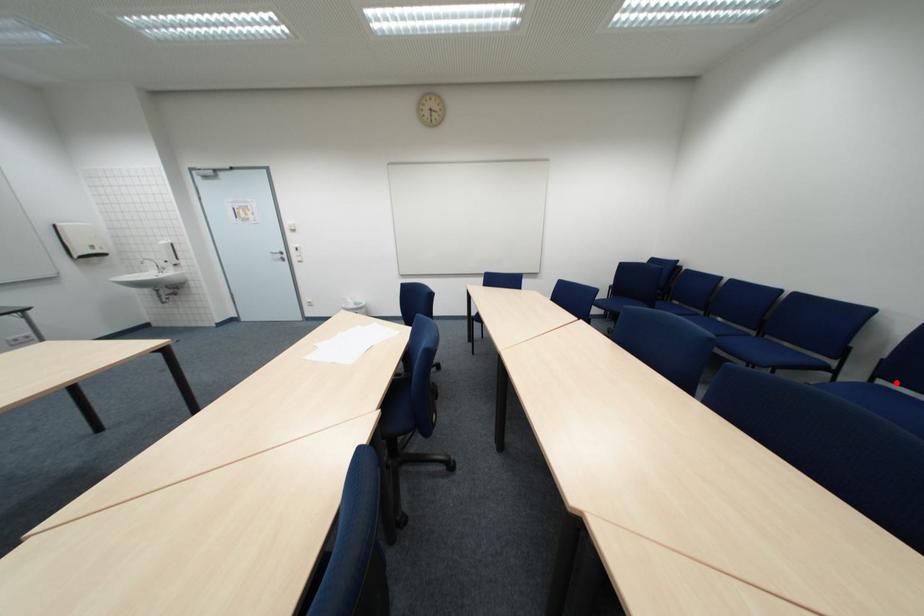
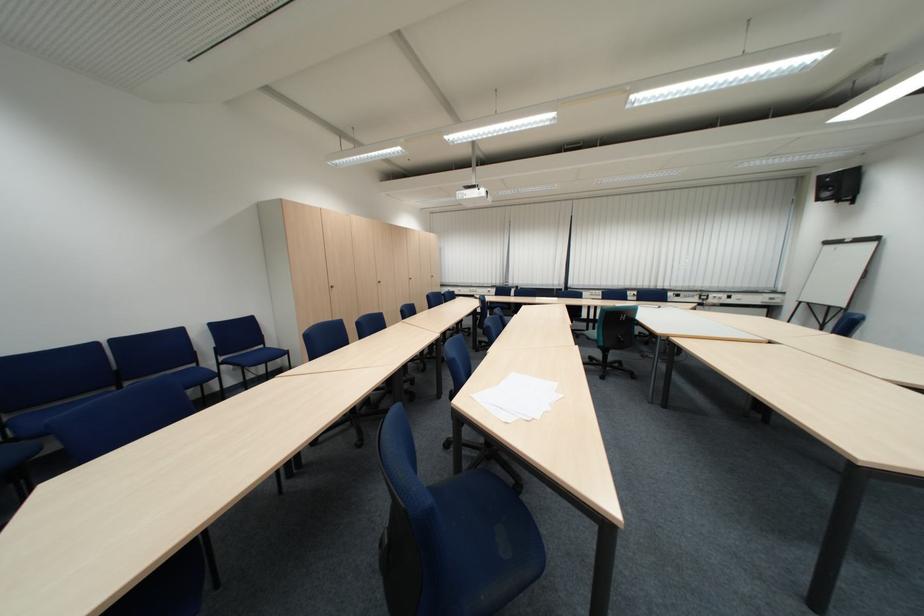
The point at the highlighted location is marked in the first image. Where is the corresponding point in the second image?

(235, 360)